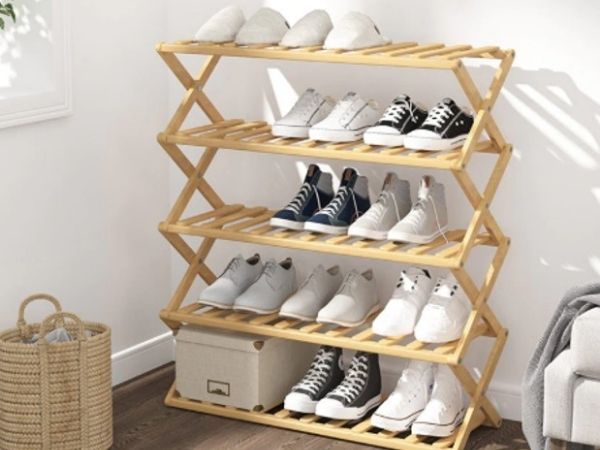
Where is `shelf under shoes`? This screenshot has width=600, height=450. shelf under shoes is located at coordinates (269, 52), (252, 142), (249, 236), (267, 330), (267, 418).